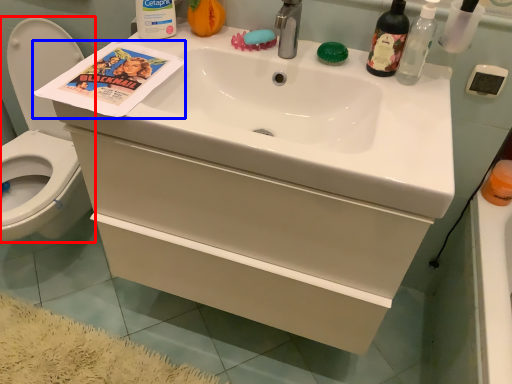
Question: Which point is further to the camera, toilet (highlighted by a red box) or comic book (highlighted by a blue box)?

Choices:
 (A) toilet
 (B) comic book

Answer: (A)